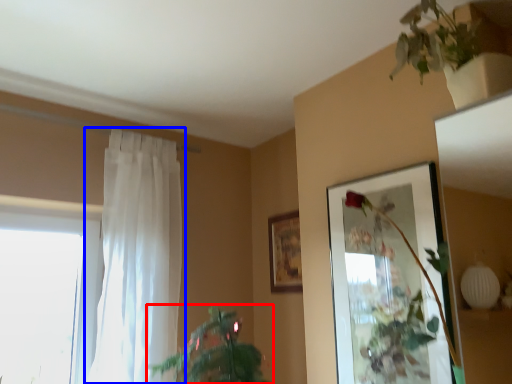
Question: Among these objects, which one is nearest to the camera, houseplant (highlighted by a red box) or curtain (highlighted by a blue box)?

Choices:
 (A) houseplant
 (B) curtain

Answer: (A)